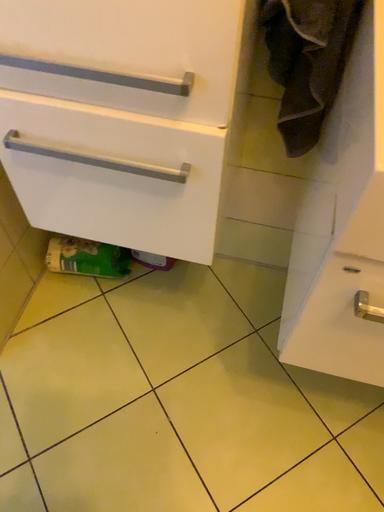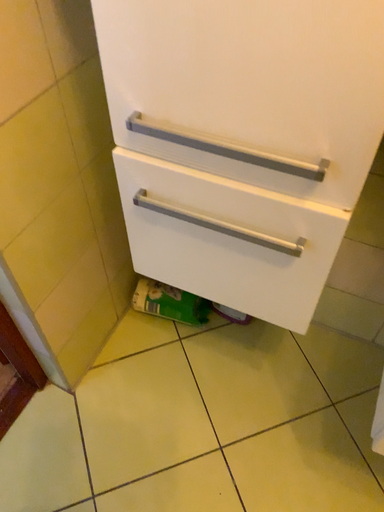
Question: How did the camera likely rotate when shooting the video?

Choices:
 (A) rotated left
 (B) rotated right

Answer: (A)